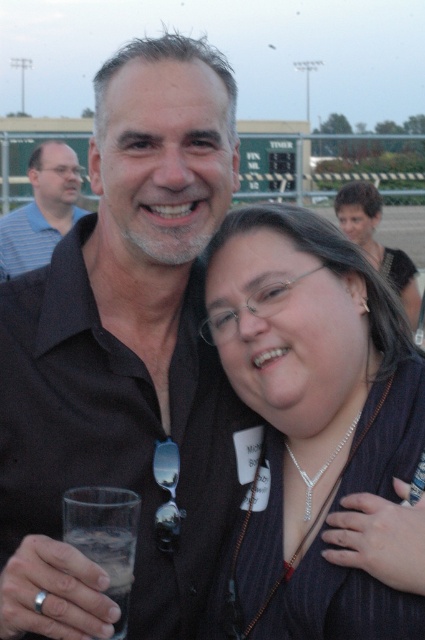
You are organizing a photo album and need to describe the spatial relationship between the black shirt at center and the matte black hair at upper right. Which object is smaller in size?

The black shirt at center has a smaller size compared to the matte black hair at upper right.

You are a photographer at an event and need to capture a photo of both the pinstriped fabric dress at center and the matte blue shirt at left. Based on their positions, which one should you focus on first to ensure both are in frame?

The pinstriped fabric dress at center is below the matte blue shirt at left, so you should focus on the matte blue shirt at left first to ensure both are in frame.

You are a photographer at an outdoor event. You need to capture a photo of both the pinstriped fabric dress at center and the matte blue shirt at left in the same frame. The camera you are using has a maximum focus range of 5 meters. Can you fit both subjects within the camera focus range?

The pinstriped fabric dress at center is 4.71 meters from the matte blue shirt at left. Since the distance between them is within the camera maximum focus range of 5 meters, both subjects can be captured in the same frame.